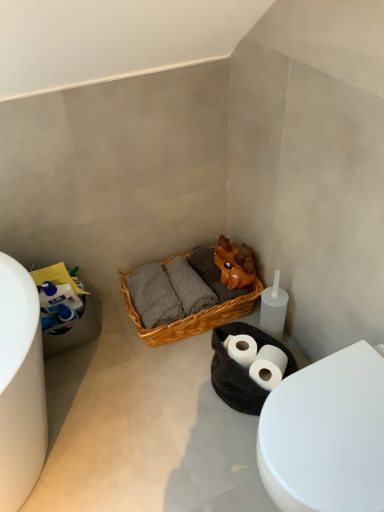
Question: Is point (66, 281) positioned closer to the camera than point (175, 328)?

Choices:
 (A) closer
 (B) farther

Answer: (A)

Question: From a real-world perspective, is white matte toilet paper at lower left above or below woven wood picnic basket at center?

Choices:
 (A) below
 (B) above

Answer: (B)

Question: Which of these objects is positioned farthest from the white matte toilet paper at lower left?

Choices:
 (A) woven wood picnic basket at center
 (B) white glossy toilet at lower right

Answer: (B)

Question: Which object is the closest to the white glossy toilet at lower right?

Choices:
 (A) woven wood picnic basket at center
 (B) white matte toilet paper at lower left

Answer: (A)